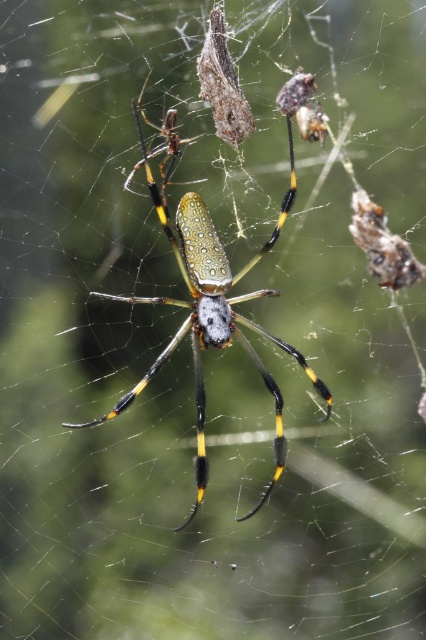
You are an entomologist examining the golden silk orb weaver spider. Based on the image, where is the shiny metallic spider at center positioned relative to the frame?

The shiny metallic spider at center is located at point 0.470 on the horizontal axis and 0.491 on the vertical axis within the frame.